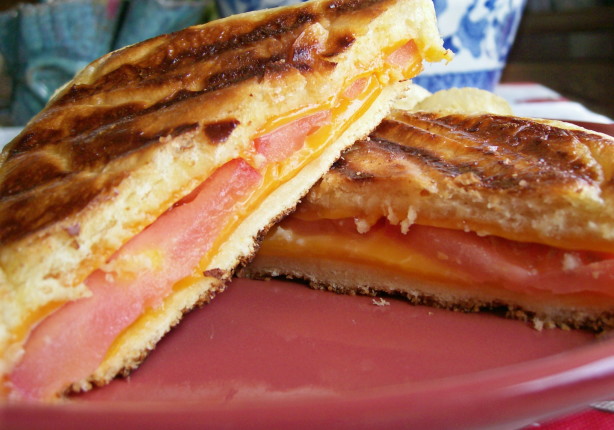
The width and height of the screenshot is (614, 430). What are the coordinates of `blue and white vase` in the screenshot? It's located at (476, 40).